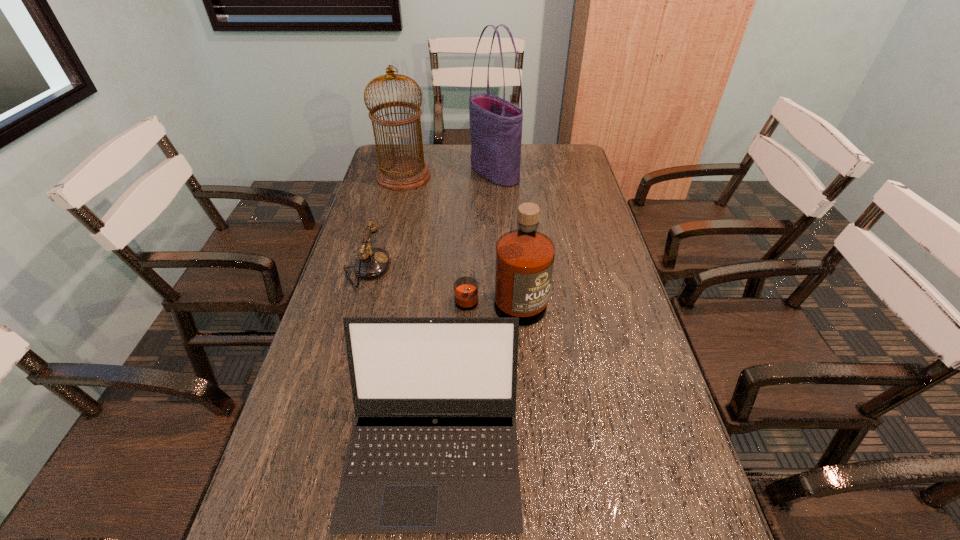
Identify the location of tote bag. (495, 124).

Image resolution: width=960 pixels, height=540 pixels. Find the location of `the second tallest object`. the second tallest object is located at coordinates (401, 173).

This screenshot has width=960, height=540. In order to click on the third tallest object in this screenshot , I will do `click(524, 258)`.

In order to click on the nearest object in this screenshot , I will do `click(433, 449)`.

Find the location of a particular element. The image size is (960, 540). the second shortest object is located at coordinates (433, 449).

Where is `telephone`? This screenshot has height=540, width=960. telephone is located at coordinates click(371, 263).

Where is `vacant space situated 0.160m on the front of the tallest object`? vacant space situated 0.160m on the front of the tallest object is located at coordinates (496, 212).

Identify the location of vacant space situated on the front-facing side of the birdcage. (513, 176).

Identify the location of vacant space located on the front label of the third tallest object. Image resolution: width=960 pixels, height=540 pixels. (508, 457).

The width and height of the screenshot is (960, 540). What are the coordinates of `vacant space located on the dial of the telephone` in the screenshot? It's located at tap(442, 269).